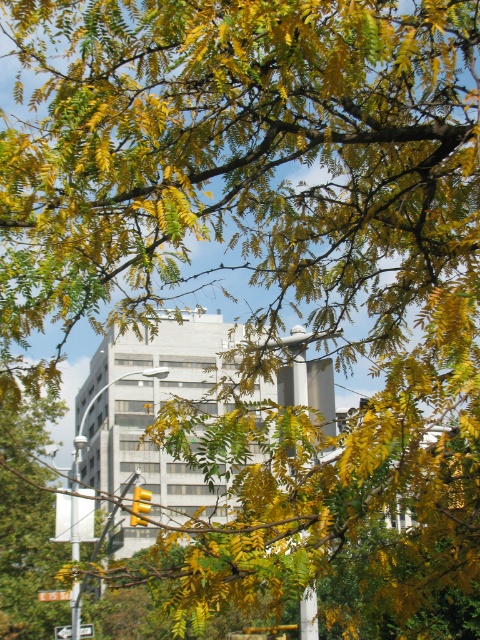
Does metallic pole at left have a greater width compared to white plastic arrow at lower left?

Yes.

Consider the image. Who is more forward, [76,541] or [62,628]?

Point [76,541] is in front.

Where is `metallic pole at left`? This screenshot has width=480, height=640. metallic pole at left is located at coordinates coord(74,529).